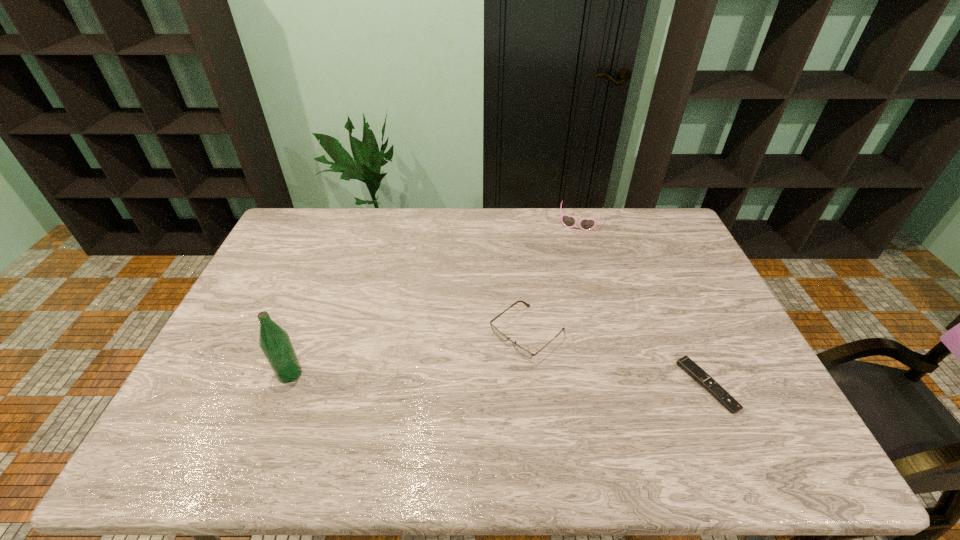
At what (x,y) coordinates should I click in order to perform the action: click on vacant space at the far edge of the desktop. Please return your answer as a coordinate pair (x, y). This screenshot has width=960, height=540. Looking at the image, I should click on (430, 228).

The image size is (960, 540). Find the location of `free space at the left edge`. free space at the left edge is located at coordinates (288, 279).

This screenshot has width=960, height=540. What are the coordinates of `vacant space at the right edge of the desktop` in the screenshot? It's located at (642, 246).

Find the location of a particular element. vacant area at the far left corner is located at coordinates (323, 233).

What are the coordinates of `vacant position at the far right corner of the desktop` in the screenshot? It's located at (655, 231).

Locate an element on the screen. blank region between the shortest object and the second object from left to right is located at coordinates click(617, 359).

You are a GUI agent. You are given a task and a screenshot of the screen. Output one action in this format:
    pyautogui.click(x=<x>, y=<y>)
    Task: Click on the vacant area that lies between the tallest object and the sunglasses
    
    Given the screenshot: What is the action you would take?
    coord(435,298)

The image size is (960, 540). I want to click on free point between the third tallest object and the rightmost object, so click(x=617, y=359).

At what (x,y) coordinates should I click in order to perform the action: click on vacant space that's between the bottle and the third object from right to left. Please return your answer as a coordinate pair (x, y). Looking at the image, I should click on (409, 353).

I want to click on free space between the bottle and the farthest object, so click(435, 298).